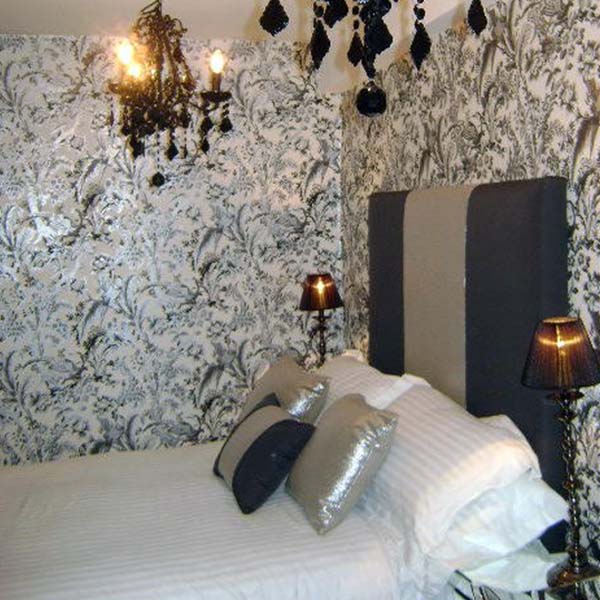
Image resolution: width=600 pixels, height=600 pixels. Identify the location of pillow. (320, 475).